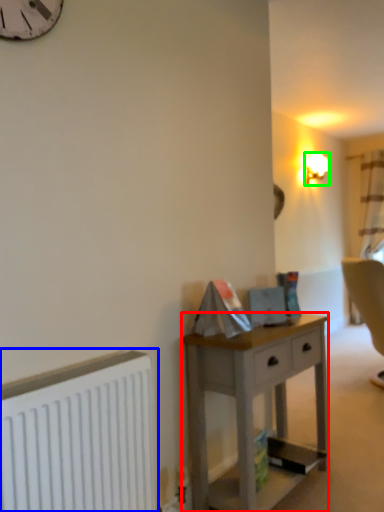
Question: Estimate the real-world distances between objects in this image. Which object is farther from desk (highlighted by a red box), radiator (highlighted by a blue box) or lamp (highlighted by a green box)?

Choices:
 (A) radiator
 (B) lamp

Answer: (B)